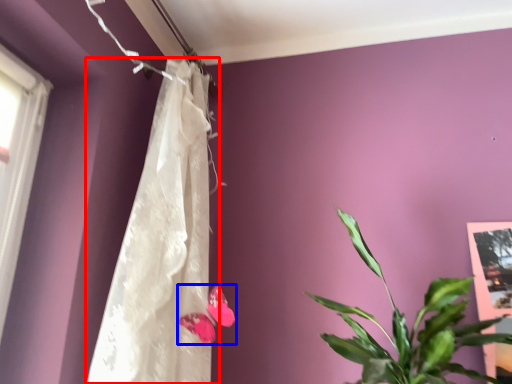
Question: Among these objects, which one is farthest to the camera, curtain (highlighted by a red box) or flower (highlighted by a blue box)?

Choices:
 (A) curtain
 (B) flower

Answer: (B)